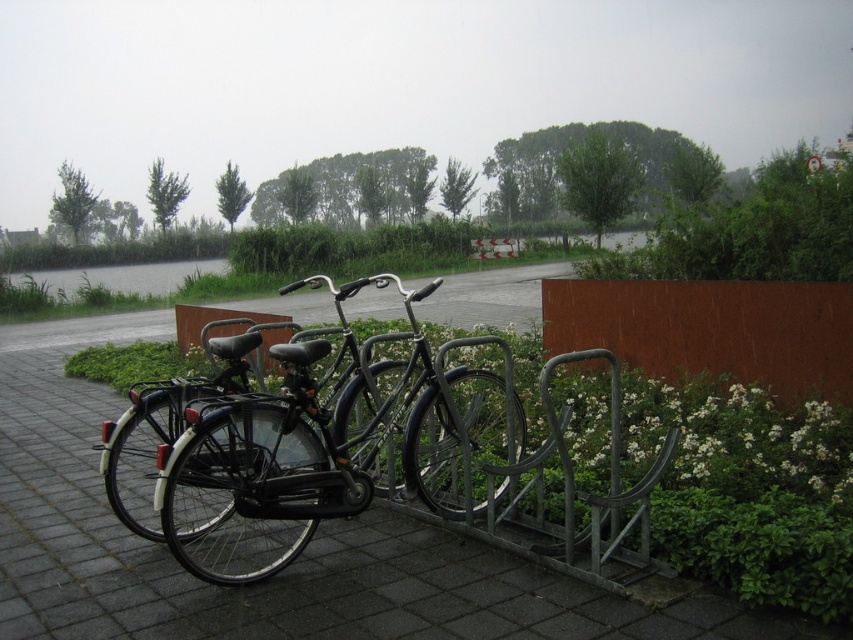
You are a delivery person who needs to place a package on the ground between the metallic gray pavement at center and the shiny black bicycle at center. The package requires 2 meters of space to be safely placed. Can you fit the package between them?

The metallic gray pavement at center and the shiny black bicycle at center are 1.85 meters apart from each other. Since the required space is 2 meters, the package cannot be safely placed between them.

You are standing at the bike rack and want to walk towards the point that is closer to you. Which point should you walk towards, point (194, 637) or point (845, 388)?

You should walk towards point (194, 637) because it is in front of point (845, 388), meaning it is closer to you.